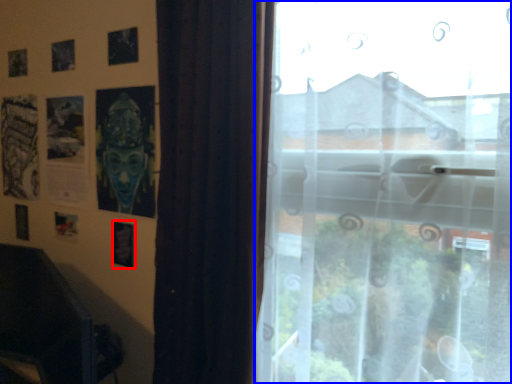
Question: Which object is further to the camera taking this photo, picture frame (highlighted by a red box) or window (highlighted by a blue box)?

Choices:
 (A) picture frame
 (B) window

Answer: (A)